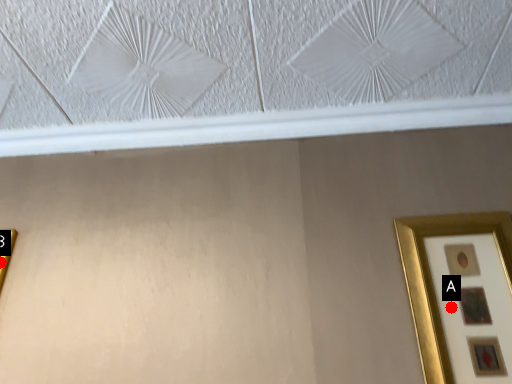
Question: Two points are circled on the image, labeled by A and B beside each circle. Which point is closer to the camera?

Choices:
 (A) A is closer
 (B) B is closer

Answer: (A)